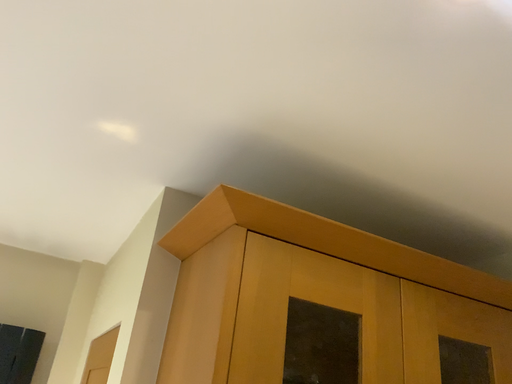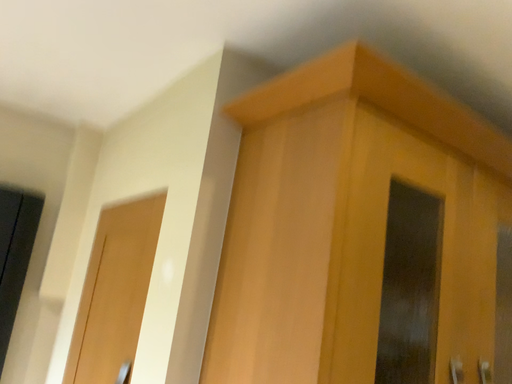
Question: Which way did the camera rotate in the video?

Choices:
 (A) rotated left
 (B) rotated right

Answer: (B)